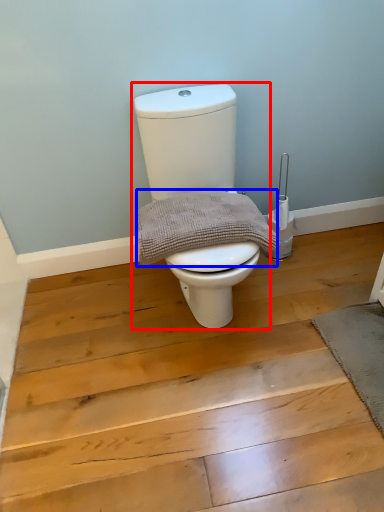
Question: Among these objects, which one is nearest to the camera, toilet (highlighted by a red box) or material (highlighted by a blue box)?

Choices:
 (A) toilet
 (B) material

Answer: (A)